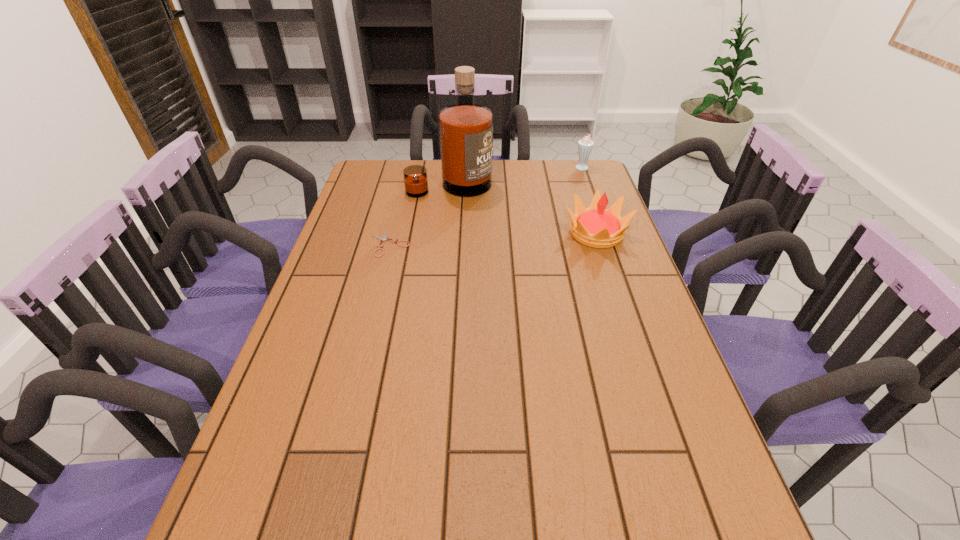
Identify the location of free location at the left edge of the desktop. (366, 195).

Find the location of a particular element. free space at the right edge of the desktop is located at coordinates (637, 380).

The image size is (960, 540). Identify the location of free region at the far left corner of the desktop. pyautogui.click(x=374, y=172).

Locate an element on the screen. This screenshot has height=540, width=960. vacant space at the far right corner of the desktop is located at coordinates (591, 165).

This screenshot has width=960, height=540. In the image, there is a desktop. Identify the location of vacant region at the near right corner. (696, 476).

You are a GUI agent. You are given a task and a screenshot of the screen. Output one action in this format:
    pyautogui.click(x=<x>, y=<y>)
    Task: Click on the empty space between the liquor and the shears
    The image size is (960, 540).
    Given the screenshot: What is the action you would take?
    pyautogui.click(x=420, y=214)

The image size is (960, 540). I want to click on vacant point located between the crown and the farthest object, so click(590, 200).

Identify the location of free space between the crown and the shortest object. The height and width of the screenshot is (540, 960). (493, 239).

You are a GUI agent. You are given a task and a screenshot of the screen. Output one action in this format:
    pyautogui.click(x=<x>, y=<y>)
    Task: Click on the vacant point located between the shears and the crown
    This screenshot has height=540, width=960.
    Given the screenshot: What is the action you would take?
    pyautogui.click(x=493, y=239)

At what (x,y) coordinates should I click in order to perform the action: click on vacant point located between the milkshake and the crown. Please return your answer as a coordinate pair (x, y). This screenshot has height=540, width=960. Looking at the image, I should click on (590, 200).